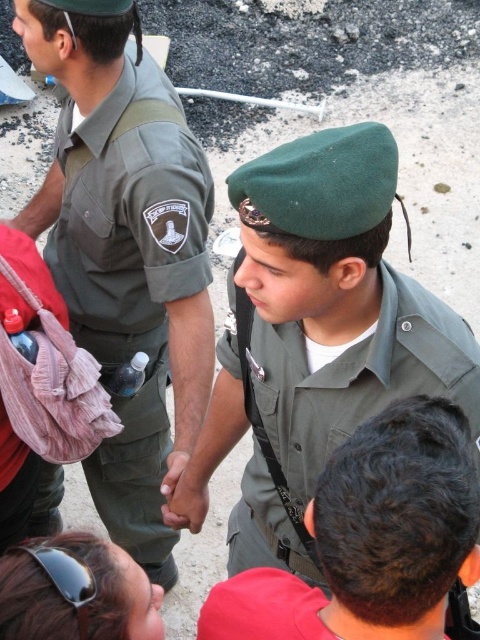
Measure the distance between green fabric uniform at left and green matte uniform at center.

green fabric uniform at left and green matte uniform at center are 25.78 inches apart.

In the scene shown: Is green fabric uniform at left above green matte uniform at center?

Yes, green fabric uniform at left is above green matte uniform at center.

Is point (165, 380) positioned after point (410, 307)?

Yes, it is.

This screenshot has height=640, width=480. Identify the location of green fabric uniform at left. (132, 280).